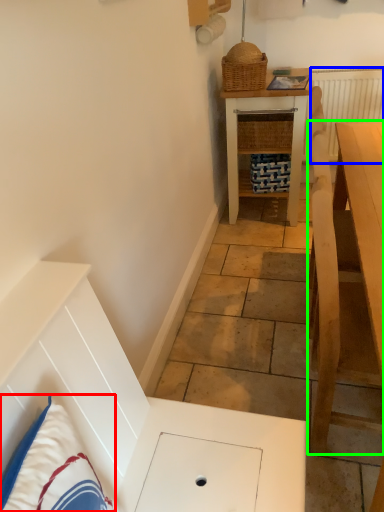
Question: Based on their relative distances, which object is farther from pillow (highlighted by a red box)? Choose from radiator (highlighted by a blue box) and table (highlighted by a green box).

Choices:
 (A) radiator
 (B) table

Answer: (A)